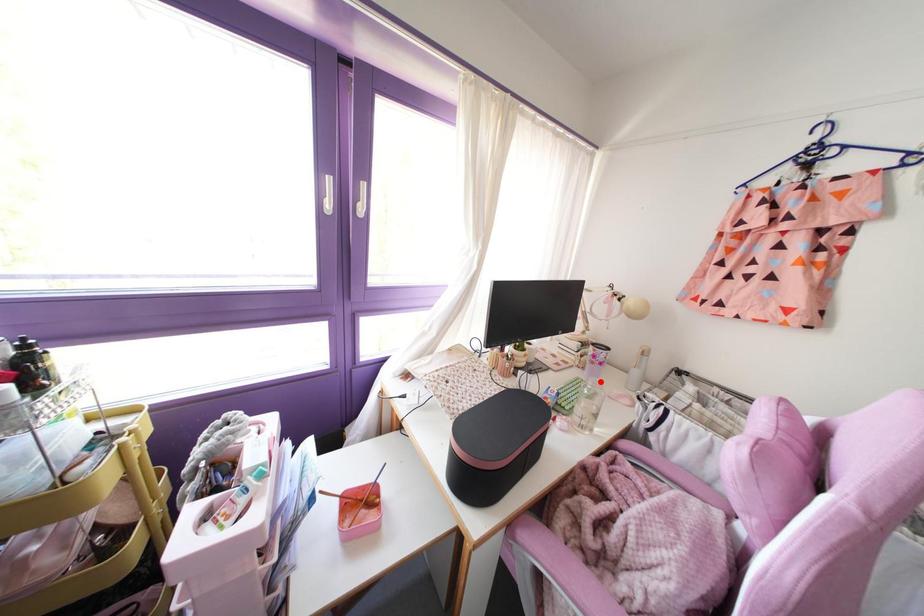
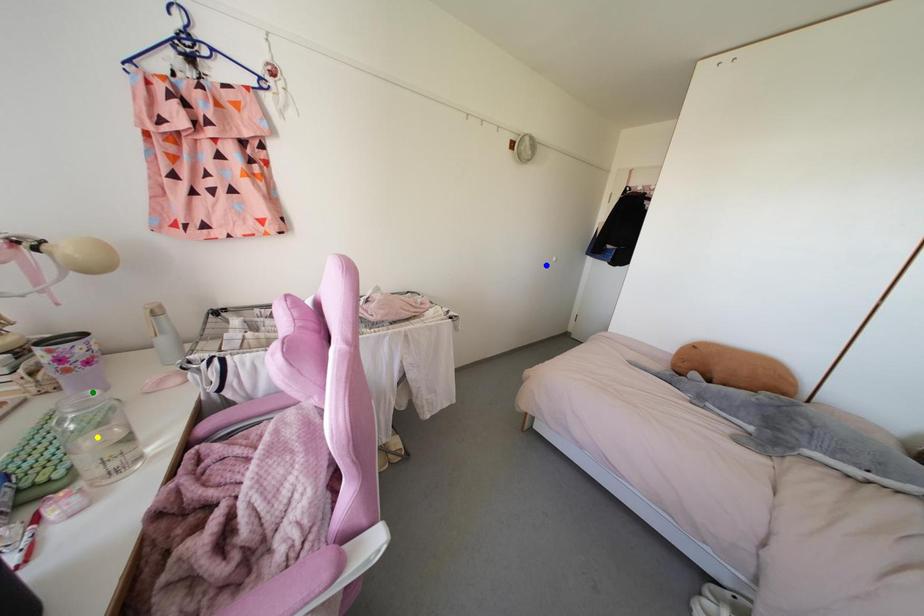
Question: I am providing you with two images of the same scene from different viewpoints. A red point is marked on the first image. You are given multiple points on the second image. Which point in image 2 represents the same 3d spot as the red point in image 1?

Choices:
 (A) blue point
 (B) yellow point
 (C) green point

Answer: (C)